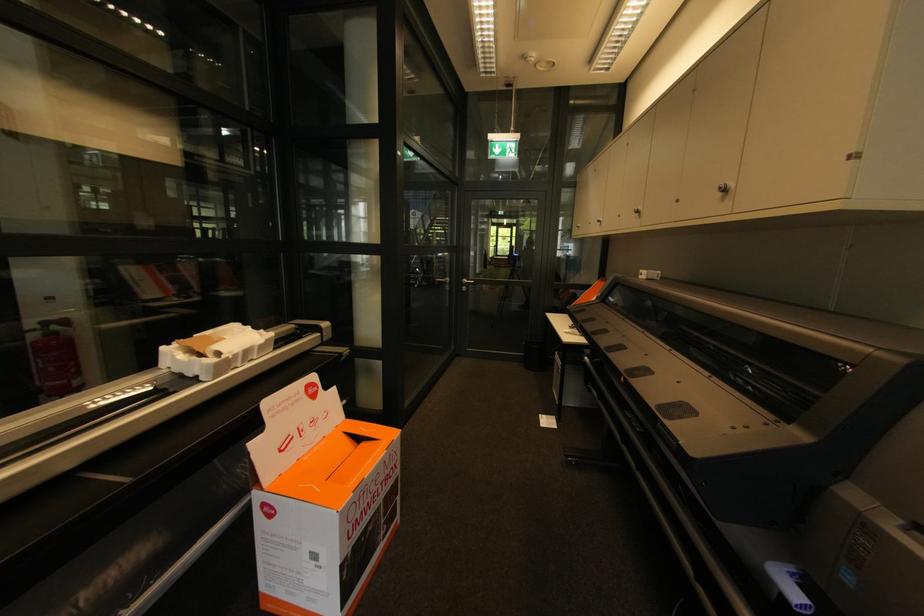
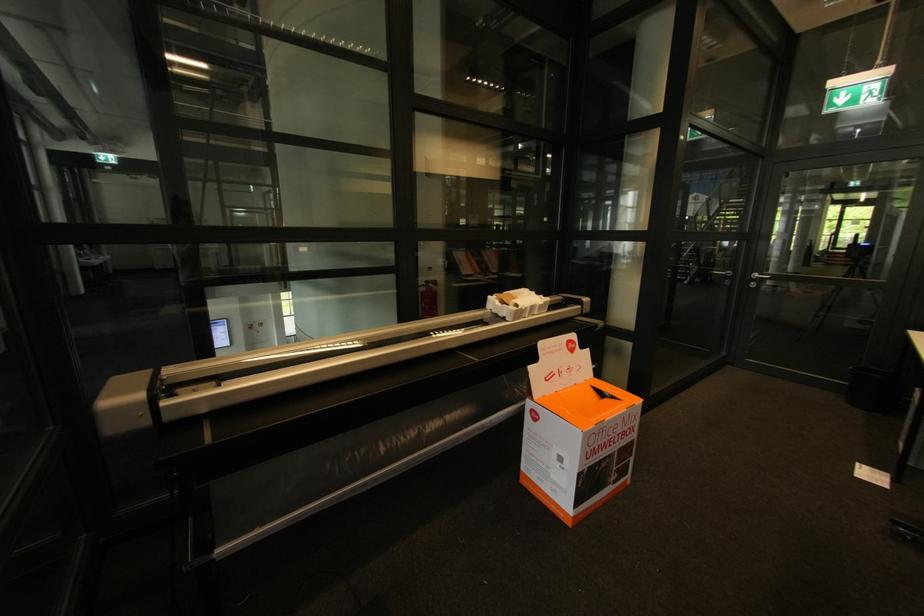
Question: Based on the continuous images, in which direction is the camera rotating? Reply with the corresponding letter.

Choices:
 (A) Left
 (B) Right
 (C) Up
 (D) Down

Answer: (A)